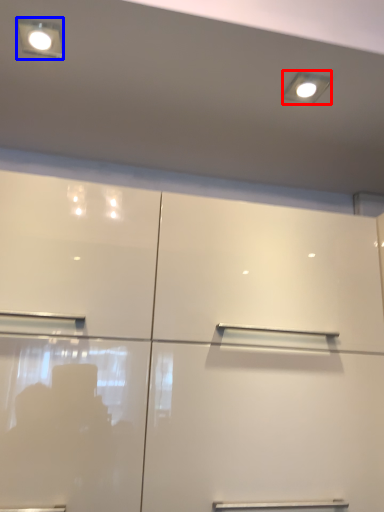
Question: Which object appears closest to the camera in this image, lighting (highlighted by a red box) or light fixture (highlighted by a blue box)?

Choices:
 (A) lighting
 (B) light fixture

Answer: (B)